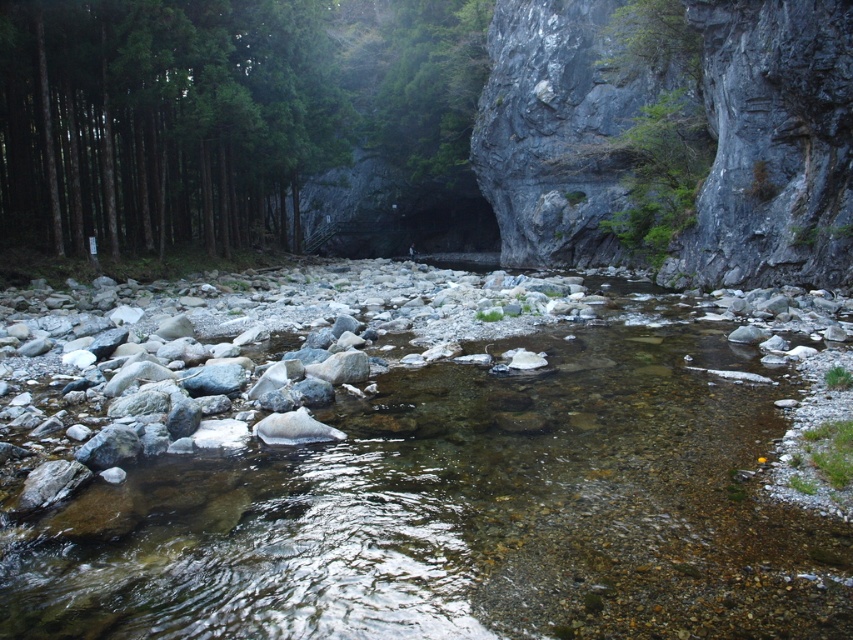
Question: Is clear water at center closer to the viewer compared to green matte tree at left?

Choices:
 (A) no
 (B) yes

Answer: (B)

Question: Is the position of clear water at center more distant than that of green matte tree at left?

Choices:
 (A) yes
 (B) no

Answer: (B)

Question: Which point is farther to the camera?

Choices:
 (A) (625, 452)
 (B) (28, 240)

Answer: (B)

Question: Is clear water at center thinner than green matte tree at left?

Choices:
 (A) no
 (B) yes

Answer: (B)

Question: Which of the following is the farthest from the observer?

Choices:
 (A) clear water at center
 (B) green matte tree at left

Answer: (B)